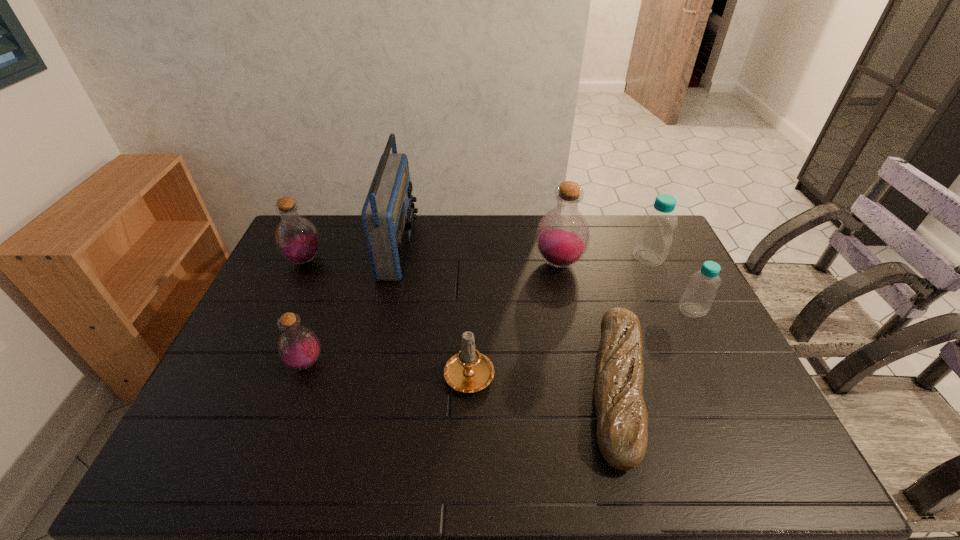
The image size is (960, 540). Identify the location of blue radio receiver. (388, 216).

Locate an element on the screen. the sixth object from right to left is located at coordinates (388, 216).

Find the location of `the tallest bottle`. the tallest bottle is located at coordinates (562, 237).

Locate an element on the screen. Image resolution: width=960 pixels, height=540 pixels. the third bottle from right to left is located at coordinates (562, 237).

Identify the location of the bigger blue bottle. (654, 237).

Image resolution: width=960 pixels, height=540 pixels. Find the location of `the second smallest purple bottle`. the second smallest purple bottle is located at coordinates (297, 239).

This screenshot has height=540, width=960. Find the location of `the leftmost purple bottle`. the leftmost purple bottle is located at coordinates (297, 239).

Find the location of a particular element. the nearer blue bottle is located at coordinates (697, 298).

The height and width of the screenshot is (540, 960). In order to click on the fourth nearest object in this screenshot , I will do point(697,298).

I want to click on the smallest purple bottle, so click(x=298, y=347).